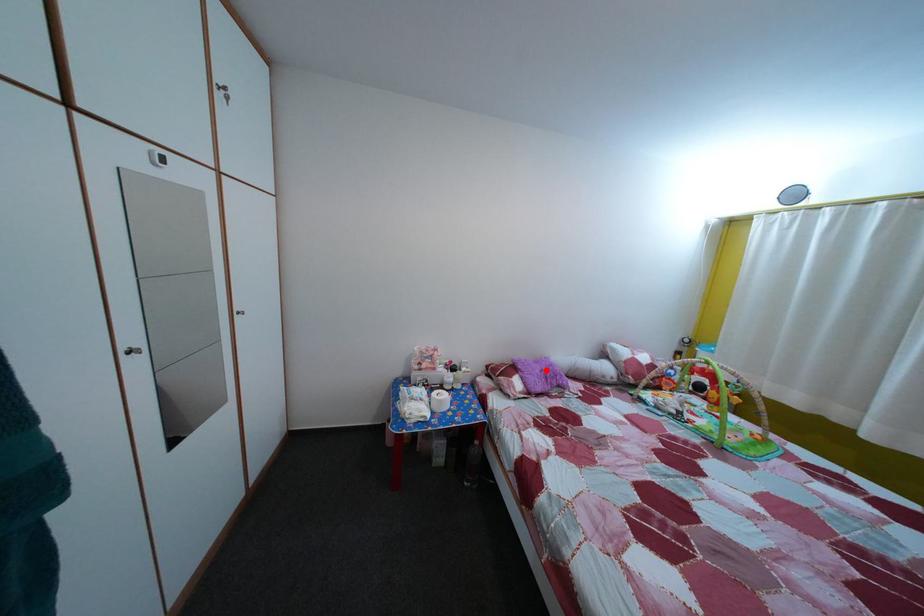
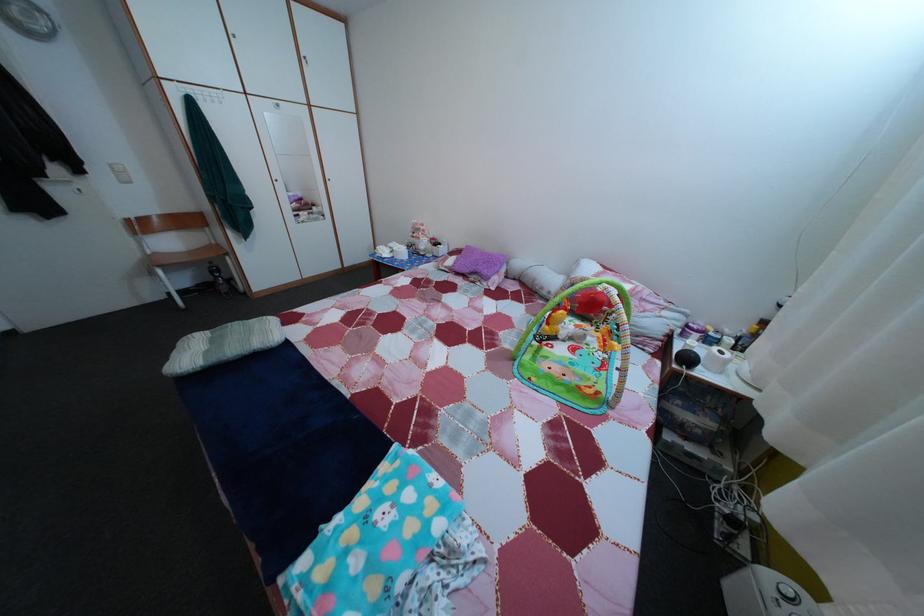
Find the pixel in the second image that matches the highlighted location in the first image.

(492, 261)